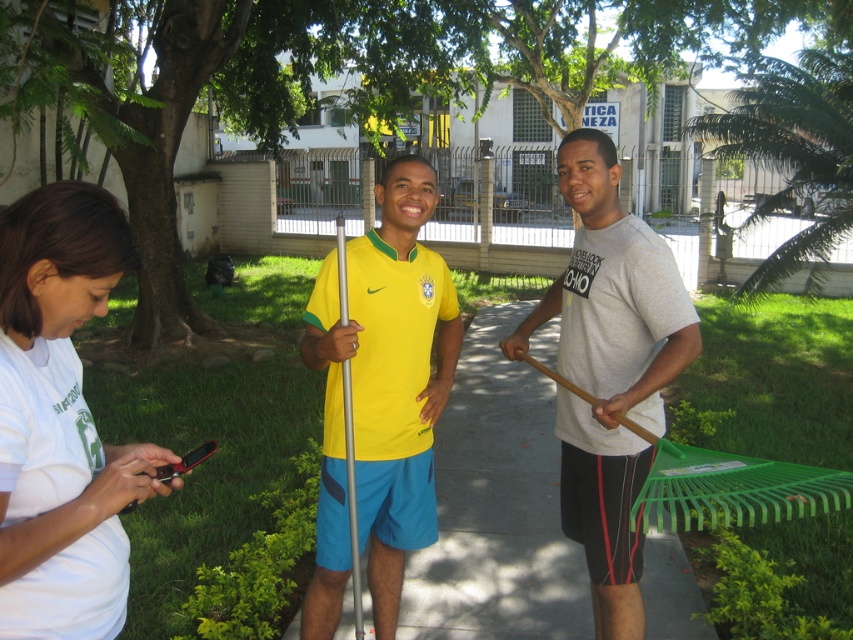
You are a delivery robot with a height of 4 feet. You need to navigate through the space between the smooth concrete pavement at center and the yellow matte jersey at center. Can you pass through this space without bending down?

The distance between the smooth concrete pavement at center and the yellow matte jersey at center is 3.44 feet. Since the robot is 4 feet tall, it will need to bend down to pass through this space.

You are a photographer trying to capture a clear shot of the white matte shirt at lower left and the smooth concrete pavement at center. Which object should you zoom in on to ensure it fills the frame more effectively?

You should zoom in on the white matte shirt at lower left because it is larger in size than the smooth concrete pavement at center, making it easier to fill the frame effectively.